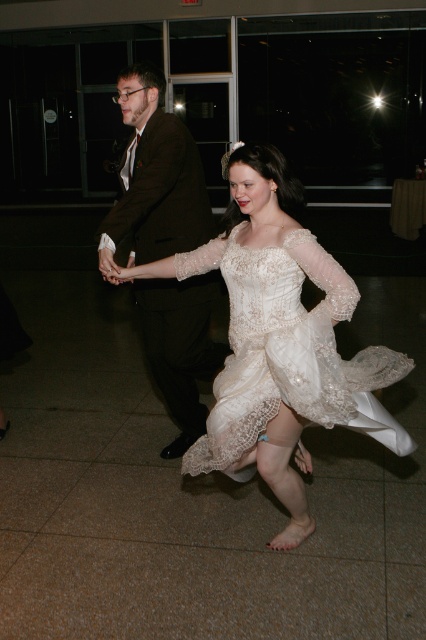
Is point (255, 355) positioned behind point (181, 150)?

No.

Locate an element on the screen. Image resolution: width=426 pixels, height=640 pixels. white lace dress at center is located at coordinates (279, 340).

At what (x,y) coordinates should I click in order to perform the action: click on white lace dress at center. Please return your answer as a coordinate pair (x, y). The height and width of the screenshot is (640, 426). Looking at the image, I should click on [x=279, y=340].

Is white lace dress at center taller than ivory lace dress at center?

Correct, white lace dress at center is much taller as ivory lace dress at center.

Is white lace dress at center bigger than ivory lace dress at center?

Yes.

Which is in front, point (242, 304) or point (371, 352)?

Point (242, 304)

Locate an element on the screen. The height and width of the screenshot is (640, 426). white lace dress at center is located at coordinates (279, 340).

Between ivory lace dress at center and dark brown suit at center, which one appears on the right side from the viewer's perspective?

ivory lace dress at center

Which is below, ivory lace dress at center or dark brown suit at center?

ivory lace dress at center is lower down.

Describe the element at coordinates (287, 349) in the screenshot. I see `ivory lace dress at center` at that location.

What are the coordinates of `ivory lace dress at center` in the screenshot? It's located at (287, 349).